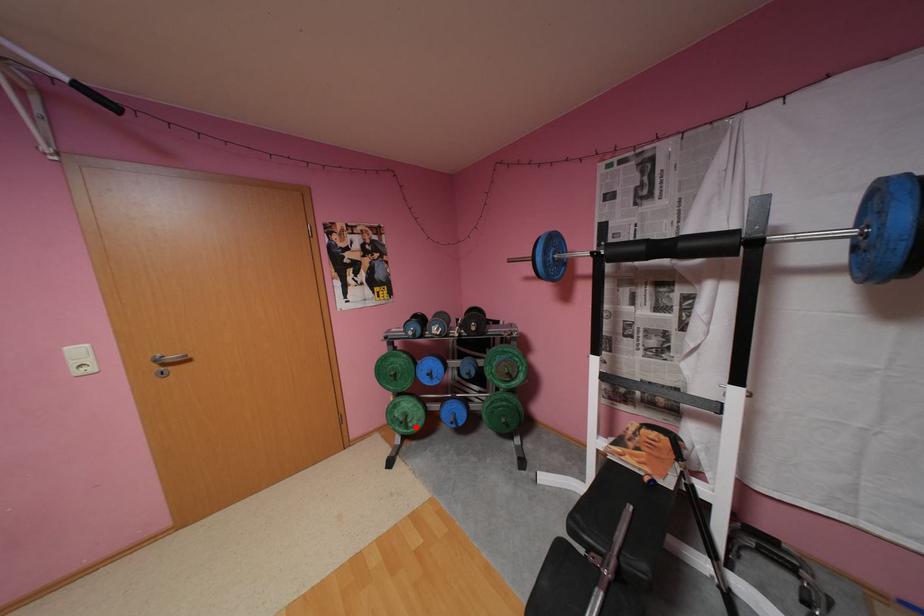
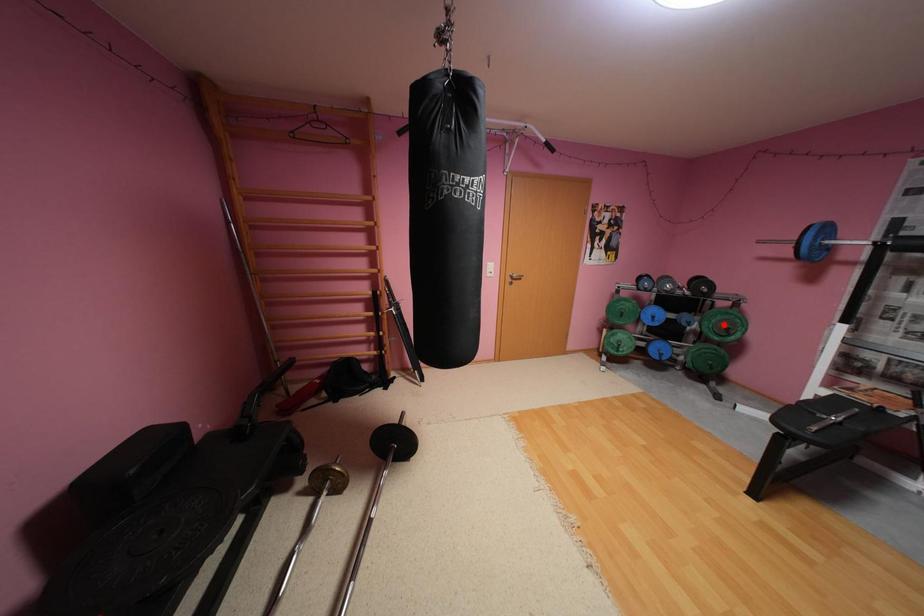
I am providing you with two images of the same scene from different viewpoints. A red point is marked on the first image and another point is marked on the second image. Does the point marked in image1 correspond to the same location as the one in image2?

No